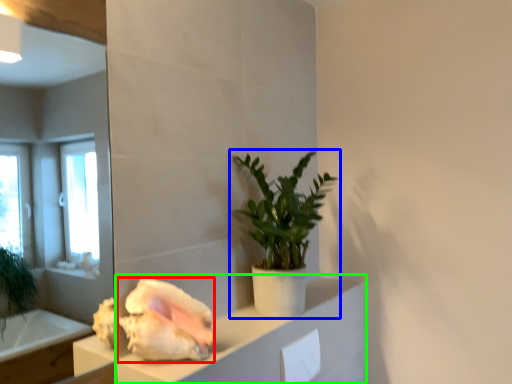
Question: Based on their relative distances, which object is nearer to flower (highlighted by a red box)? Choose from houseplant (highlighted by a blue box) and cabinetry (highlighted by a green box).

Choices:
 (A) houseplant
 (B) cabinetry

Answer: (B)